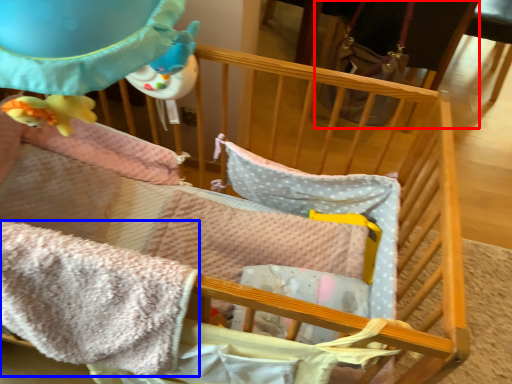
Question: Which object appears closest to the camera in this image, feeding chair (highlighted by a red box) or blanket (highlighted by a blue box)?

Choices:
 (A) feeding chair
 (B) blanket

Answer: (B)